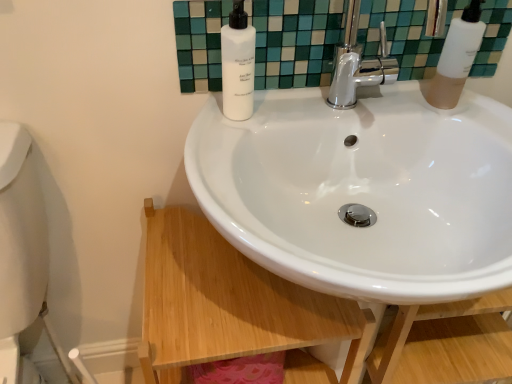
Locate an element on the screen. vacant space situated on the left part of white matte bottle at upper right, acting as the first soap dispenser starting from the right is located at coordinates (x=372, y=110).